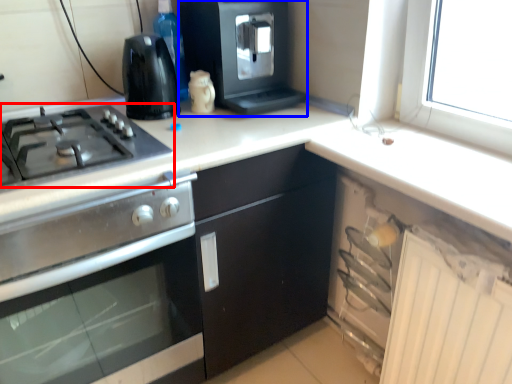
Question: Which object appears farthest to the camera in this image, gas stove (highlighted by a red box) or kitchen appliance (highlighted by a blue box)?

Choices:
 (A) gas stove
 (B) kitchen appliance

Answer: (B)